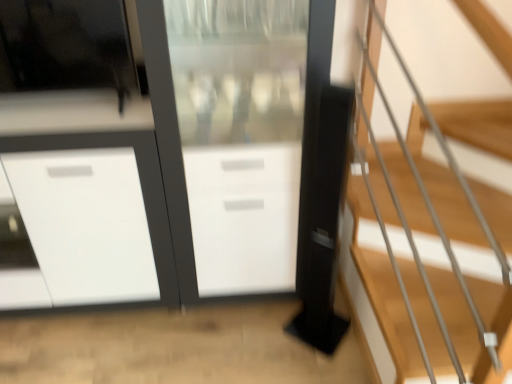
What is the approximate height of transparent glass screen door at center?

The height of transparent glass screen door at center is 4.37 feet.

I want to click on wooden stairs at right, so click(x=426, y=263).

Describe the element at coordinates (94, 216) in the screenshot. I see `white glossy cabinet at center` at that location.

Measure the distance between white glossy cabinet at center and camera.

white glossy cabinet at center and camera are 4.83 feet apart.

In order to click on transparent glass screen door at center in this screenshot , I will do `click(240, 137)`.

Are transparent glass screen door at center and wooden stairs at right far apart?

Actually, transparent glass screen door at center and wooden stairs at right are a little close together.

Can you confirm if transparent glass screen door at center is shorter than wooden stairs at right?

No.

Is transparent glass screen door at center further to the viewer compared to wooden stairs at right?

Yes, it is behind wooden stairs at right.

Considering the points (213, 295) and (404, 209), which point is in front, point (213, 295) or point (404, 209)?

The point (404, 209) is closer to the camera.

Considering the positions of objects wooden stairs at right and white glossy cabinet at center in the image provided, who is more to the left, wooden stairs at right or white glossy cabinet at center?

Positioned to the left is white glossy cabinet at center.

Between wooden stairs at right and white glossy cabinet at center, which one has larger width?

wooden stairs at right.

Image resolution: width=512 pixels, height=384 pixels. In order to click on cabinetry lying on the left of wooden stairs at right in this screenshot , I will do `click(94, 216)`.

Can you see wooden stairs at right touching white glossy cabinet at center?

No, wooden stairs at right is not touching white glossy cabinet at center.

Which of these two, transparent glass screen door at center or white glossy cabinet at center, is wider?

white glossy cabinet at center.

Is transparent glass screen door at center to the left or to the right of white glossy cabinet at center in the image?

In the image, transparent glass screen door at center appears on the right side of white glossy cabinet at center.

Considering the positions of objects transparent glass screen door at center and white glossy cabinet at center in the image provided, who is in front, transparent glass screen door at center or white glossy cabinet at center?

Positioned in front is transparent glass screen door at center.

Based on the photo, considering the relative sizes of wooden stairs at right and transparent glass screen door at center in the image provided, is wooden stairs at right taller than transparent glass screen door at center?

In fact, wooden stairs at right may be shorter than transparent glass screen door at center.

Considering the relative sizes of wooden stairs at right and transparent glass screen door at center in the image provided, is wooden stairs at right thinner than transparent glass screen door at center?

In fact, wooden stairs at right might be wider than transparent glass screen door at center.

Considering the sizes of wooden stairs at right and transparent glass screen door at center in the image, is wooden stairs at right bigger or smaller than transparent glass screen door at center?

Considering their sizes, wooden stairs at right takes up less space than transparent glass screen door at center.

Does wooden stairs at right appear on the right side of transparent glass screen door at center?

Indeed, wooden stairs at right is positioned on the right side of transparent glass screen door at center.

Which is behind, white glossy cabinet at center or transparent glass screen door at center?

white glossy cabinet at center is behind.

Is white glossy cabinet at center positioned with its back to transparent glass screen door at center?

No, white glossy cabinet at center is not facing away from transparent glass screen door at center.

Is white glossy cabinet at center located outside transparent glass screen door at center?

Yes, white glossy cabinet at center is outside of transparent glass screen door at center.

From the image's perspective, which is above, white glossy cabinet at center or transparent glass screen door at center?

transparent glass screen door at center, from the image's perspective.

In the scene shown: Can you confirm if white glossy cabinet at center is taller than wooden stairs at right?

In fact, white glossy cabinet at center may be shorter than wooden stairs at right.

In the image, is white glossy cabinet at center on the left side or the right side of wooden stairs at right?

In the image, white glossy cabinet at center appears on the left side of wooden stairs at right.

From a real-world perspective, is white glossy cabinet at center above or below wooden stairs at right?

white glossy cabinet at center is situated lower than wooden stairs at right in the real world.

Is point (39, 152) positioned after point (456, 227)?

No, it is not.

Locate an element on the screen. The image size is (512, 384). screen door that appears above the wooden stairs at right (from the image's perspective) is located at coordinates (240, 137).

You are a GUI agent. You are given a task and a screenshot of the screen. Output one action in this format:
    pyautogui.click(x=<x>, y=<y>)
    Task: Click on the cabinetry behind the wooden stairs at right
    
    Given the screenshot: What is the action you would take?
    pyautogui.click(x=94, y=216)

Consider the image. Considering their positions, is transparent glass screen door at center positioned further to wooden stairs at right than white glossy cabinet at center?

Based on the image, white glossy cabinet at center appears to be further to wooden stairs at right.

From the image, which object appears to be farther from white glossy cabinet at center, wooden stairs at right or transparent glass screen door at center?

wooden stairs at right lies further to white glossy cabinet at center than the other object.

In the scene shown: Looking at the image, which one is located closer to transparent glass screen door at center, white glossy cabinet at center or wooden stairs at right?

Among the two, white glossy cabinet at center is located nearer to transparent glass screen door at center.

Looking at the image, which one is located further to wooden stairs at right, white glossy cabinet at center or transparent glass screen door at center?

The object further to wooden stairs at right is white glossy cabinet at center.

From the image, which object appears to be farther from white glossy cabinet at center, transparent glass screen door at center or wooden stairs at right?

wooden stairs at right.

From the image, which object appears to be farther from transparent glass screen door at center, wooden stairs at right or white glossy cabinet at center?

Result: The object further to transparent glass screen door at center is wooden stairs at right.

Locate an element on the screen. screen door between white glossy cabinet at center and wooden stairs at right is located at coordinates (240, 137).